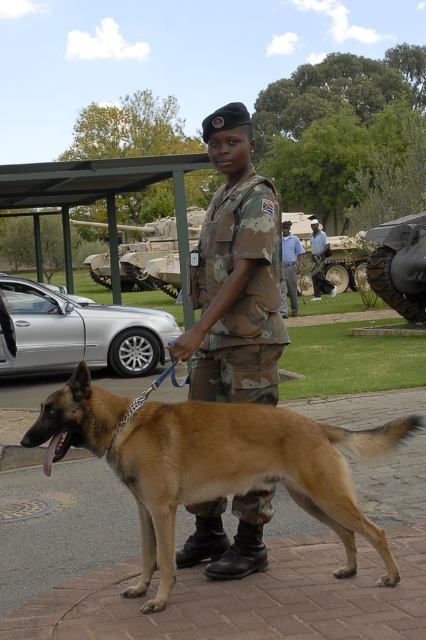
You are a soldier standing at the point marked as point (x=230, y=323) in the image. You need to move to a nearby water station located 15 feet away from your current position. Is the water station within your reach without moving more than 12 feet?

The distance between point (x=230, y=323) and the viewer is 12.28 feet. Since the water station is 15 feet away from your current position, it is beyond the 12 feet limit, so you cannot reach it without moving more than 12 feet.

You are a photographer standing at the edge of the paved area where the soldier and the dog are located. You need to take a photo of both the camouflage fabric uniform at center and the camouflage paint tank at center. Given that your camera has a maximum focus range of 70 feet, will you be able to capture both objects clearly in the same frame?

The camouflage fabric uniform at center is 70.97 feet away from the camouflage paint tank at center. Since the maximum focus range of the camera is 70 feet, the distance between the two objects exceeds this limit. Therefore, you will not be able to capture both objects clearly in the same frame.

You are a drone operator trying to locate two specific points in the image. The first point is at coordinate point (166, 556) and the second is at point (299, 262). From the perspective of someone standing at the soldier, which point is closer to them?

Point (166, 556) is in front of point (299, 262), so from the soldier perspective, point (166, 556) is closer to them.